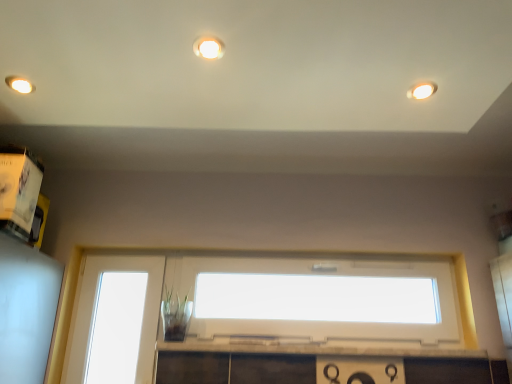
Image resolution: width=512 pixels, height=384 pixels. In order to click on white plastic window at center, which is the 1th window from right to left in this screenshot , I will do `click(317, 299)`.

This screenshot has height=384, width=512. What do you see at coordinates (19, 84) in the screenshot?
I see `matte white light fixture at upper left, the 1th lighting in the left-to-right sequence` at bounding box center [19, 84].

Where is `white plastic window at center, which is the 1th window from right to left`? white plastic window at center, which is the 1th window from right to left is located at coordinates (317, 299).

Considering the sizes of objects matte white light fixture at upper center, which is counted as the 2th lighting, starting from the right, and transparent glass window at lower left, the 1th window in the left-to-right sequence, in the image provided, who is smaller, matte white light fixture at upper center, which is counted as the 2th lighting, starting from the right, or transparent glass window at lower left, the 1th window in the left-to-right sequence,?

Smaller between the two is matte white light fixture at upper center, which is counted as the 2th lighting, starting from the right.

Based on the photo, does matte white light fixture at upper center, marked as the first lighting in a front-to-back arrangement, lie in front of transparent glass window at lower left, which appears as the 2th window when viewed from the right?

That is True.

Choose the correct answer: Is matte white light fixture at upper center, the third lighting when ordered from back to front, inside transparent glass window at lower left, which appears as the 2th window when viewed from the right, or outside it?

matte white light fixture at upper center, the third lighting when ordered from back to front, exists outside the volume of transparent glass window at lower left, which appears as the 2th window when viewed from the right.

Is matte white light fixture at upper center, which is counted as the 2th lighting, starting from the right, to the left or to the right of transparent glass window at lower left, which appears as the 2th window when viewed from the right, in the image?

In the image, matte white light fixture at upper center, which is counted as the 2th lighting, starting from the right, appears on the right side of transparent glass window at lower left, which appears as the 2th window when viewed from the right.

Consider the image. From the image's perspective, is white plastic window at center, which is the 1th window from right to left, positioned above or below matte white light fixture at upper center, the 3th lighting in the bottom-to-top sequence?

white plastic window at center, which is the 1th window from right to left, is below matte white light fixture at upper center, the 3th lighting in the bottom-to-top sequence.

Identify the location of window that is the 1st one below the matte white light fixture at upper center, which is counted as the 2th lighting, starting from the right (from a real-world perspective). (317, 299).

Is white plastic window at center, the second window from the left, oriented towards matte white light fixture at upper center, the 2th lighting from the left?

No, white plastic window at center, the second window from the left, is not turned towards matte white light fixture at upper center, the 2th lighting from the left.

In the scene shown: Looking at their sizes, would you say white plastic window at center, the second window from the left, is wider or thinner than matte white light fixture at upper center, which is counted as the 2th lighting, starting from the right?

Clearly, white plastic window at center, the second window from the left, has more width compared to matte white light fixture at upper center, which is counted as the 2th lighting, starting from the right.

Considering the points (333, 312) and (422, 98), which point is behind, point (333, 312) or point (422, 98)?

The point (333, 312) is behind.

Is white plastic window at center, the second window from the left, looking in the opposite direction of matte white light fixture at upper right, positioned as the first lighting in bottom-to-top order?

No.

Measure the distance from white plastic window at center, which is the 1th window from right to left, to matte white light fixture at upper right, marked as the 2th lighting in a front-to-back arrangement.

A distance of 3.45 meters exists between white plastic window at center, which is the 1th window from right to left, and matte white light fixture at upper right, marked as the 2th lighting in a front-to-back arrangement.

Which object is closer to the camera, white plastic window at center, which is the 1th window from right to left, or matte white light fixture at upper right, positioned as the first lighting in bottom-to-top order?

matte white light fixture at upper right, positioned as the first lighting in bottom-to-top order, is more forward.

From a real-world perspective, between transparent glass window at lower left, the 1th window in the left-to-right sequence, and matte white light fixture at upper left, which is the 3th lighting from right to left, who is vertically higher?

matte white light fixture at upper left, which is the 3th lighting from right to left.

Considering the points (104, 314) and (28, 83), which point is behind, point (104, 314) or point (28, 83)?

The point (104, 314) is behind.

Is transparent glass window at lower left, the 1th window in the left-to-right sequence, wider than matte white light fixture at upper left, which is the 3th lighting from right to left?

In fact, transparent glass window at lower left, the 1th window in the left-to-right sequence, might be narrower than matte white light fixture at upper left, which is the 3th lighting from right to left.

Is transparent glass window at lower left, the 1th window in the left-to-right sequence, touching matte white light fixture at upper right, the 3th lighting viewed from the left?

No, transparent glass window at lower left, the 1th window in the left-to-right sequence, is not next to matte white light fixture at upper right, the 3th lighting viewed from the left.

Which of these two, transparent glass window at lower left, the 1th window in the left-to-right sequence, or matte white light fixture at upper right, the 3th lighting viewed from the left, stands shorter?

Standing shorter between the two is matte white light fixture at upper right, the 3th lighting viewed from the left.

Which object is closer to the camera taking this photo, transparent glass window at lower left, which appears as the 2th window when viewed from the right, or matte white light fixture at upper right, the 3th lighting viewed from the left?

matte white light fixture at upper right, the 3th lighting viewed from the left.

Does matte white light fixture at upper left, which is the 3th lighting from right to left, appear on the left side of matte white light fixture at upper right, the 3th lighting viewed from the left?

Yes.

From a real-world perspective, is matte white light fixture at upper left, which is the 3th lighting from right to left, physically below matte white light fixture at upper right, the 3th lighting viewed from the left?

Incorrect, from a real-world perspective, matte white light fixture at upper left, which is the 3th lighting from right to left, is higher than matte white light fixture at upper right, the 3th lighting viewed from the left.

Does matte white light fixture at upper left, the 1th lighting in the left-to-right sequence, come in front of matte white light fixture at upper right, marked as the 2th lighting in a front-to-back arrangement?

No, matte white light fixture at upper left, the 1th lighting in the left-to-right sequence, is further to the viewer.

You are a GUI agent. You are given a task and a screenshot of the screen. Output one action in this format:
    pyautogui.click(x=<x>, y=<y>)
    Task: Click on the 2nd lighting counting from the left of the matte white light fixture at upper right, marked as the third lighting in a top-to-bottom arrangement
    This screenshot has width=512, height=384.
    Given the screenshot: What is the action you would take?
    19,84

Is matte white light fixture at upper left, which is the 3th lighting from right to left, further to the viewer compared to matte white light fixture at upper center, which is counted as the 2th lighting, starting from the right?

Yes, matte white light fixture at upper left, which is the 3th lighting from right to left, is further from the camera.

From the image's perspective, is matte white light fixture at upper left, marked as the first lighting in a back-to-front arrangement, above or below matte white light fixture at upper center, which ranks as the 1th lighting in top-to-bottom order?

matte white light fixture at upper left, marked as the first lighting in a back-to-front arrangement, is below matte white light fixture at upper center, which ranks as the 1th lighting in top-to-bottom order.

Is matte white light fixture at upper center, which is counted as the 2th lighting, starting from the right, a part of matte white light fixture at upper left, which is the 3th lighting from right to left?

Actually, matte white light fixture at upper center, which is counted as the 2th lighting, starting from the right, is outside matte white light fixture at upper left, which is the 3th lighting from right to left.

From the picture: Is matte white light fixture at upper left, which is the 3th lighting from right to left, oriented towards matte white light fixture at upper center, the 2th lighting from the left?

No, matte white light fixture at upper left, which is the 3th lighting from right to left, is not oriented towards matte white light fixture at upper center, the 2th lighting from the left.

You are a GUI agent. You are given a task and a screenshot of the screen. Output one action in this format:
    pyautogui.click(x=<x>, y=<y>)
    Task: Click on the 2nd window behind when counting from the matte white light fixture at upper center, the 3th lighting in the bottom-to-top sequence
    This screenshot has height=384, width=512.
    Given the screenshot: What is the action you would take?
    pyautogui.click(x=116, y=328)

The width and height of the screenshot is (512, 384). What are the coordinates of `lighting that is the 2nd object above the white plastic window at center, the second window from the left (from a real-world perspective)` in the screenshot? It's located at [209, 49].

Estimate the real-world distances between objects in this image. Which object is closer to matte white light fixture at upper left, which is the 3th lighting from right to left, transparent glass window at lower left, the 1th window in the left-to-right sequence, or matte white light fixture at upper right, marked as the third lighting in a top-to-bottom arrangement?

Among the two, matte white light fixture at upper right, marked as the third lighting in a top-to-bottom arrangement, is located nearer to matte white light fixture at upper left, which is the 3th lighting from right to left.

When comparing their distances from transparent glass window at lower left, the 1th window in the left-to-right sequence, does matte white light fixture at upper center, the third lighting when ordered from back to front, or matte white light fixture at upper right, positioned as the first lighting in bottom-to-top order, seem closer?

Among the two, matte white light fixture at upper center, the third lighting when ordered from back to front, is located nearer to transparent glass window at lower left, the 1th window in the left-to-right sequence.

When comparing their distances from matte white light fixture at upper right, positioned as the 1th lighting in right-to-left order, does matte white light fixture at upper left, which is the 3th lighting from right to left, or matte white light fixture at upper center, the 2th lighting from the left, seem further?

matte white light fixture at upper left, which is the 3th lighting from right to left, is positioned further to the anchor matte white light fixture at upper right, positioned as the 1th lighting in right-to-left order.

When comparing their distances from transparent glass window at lower left, which appears as the 2th window when viewed from the right, does matte white light fixture at upper right, positioned as the 1th lighting in right-to-left order, or matte white light fixture at upper left, the 1th lighting in the left-to-right sequence, seem closer?

matte white light fixture at upper left, the 1th lighting in the left-to-right sequence, is closer to transparent glass window at lower left, which appears as the 2th window when viewed from the right.

Considering their positions, is matte white light fixture at upper left, acting as the 3th lighting starting from the front, positioned closer to matte white light fixture at upper right, marked as the third lighting in a top-to-bottom arrangement, than transparent glass window at lower left, which appears as the 2th window when viewed from the right?

Among the two, matte white light fixture at upper left, acting as the 3th lighting starting from the front, is located nearer to matte white light fixture at upper right, marked as the third lighting in a top-to-bottom arrangement.

Which object lies nearer to the anchor point matte white light fixture at upper center, which ranks as the 1th lighting in top-to-bottom order, matte white light fixture at upper right, placed as the second lighting when sorted from back to front, or white plastic window at center, the second window from the left?

Among the two, matte white light fixture at upper right, placed as the second lighting when sorted from back to front, is located nearer to matte white light fixture at upper center, which ranks as the 1th lighting in top-to-bottom order.

Looking at the image, which one is located further to matte white light fixture at upper left, acting as the 3th lighting starting from the front, transparent glass window at lower left, which appears as the 2th window when viewed from the right, or matte white light fixture at upper center, marked as the first lighting in a front-to-back arrangement?

The object further to matte white light fixture at upper left, acting as the 3th lighting starting from the front, is transparent glass window at lower left, which appears as the 2th window when viewed from the right.

Considering their positions, is white plastic window at center, which is the 1th window from right to left, positioned further to matte white light fixture at upper left, the 1th lighting in the left-to-right sequence, than transparent glass window at lower left, the 1th window in the left-to-right sequence?

white plastic window at center, which is the 1th window from right to left, is positioned further to the anchor matte white light fixture at upper left, the 1th lighting in the left-to-right sequence.

You are a GUI agent. You are given a task and a screenshot of the screen. Output one action in this format:
    pyautogui.click(x=<x>, y=<y>)
    Task: Click on the lighting between matte white light fixture at upper left, the 1th lighting in the left-to-right sequence, and matte white light fixture at upper right, marked as the third lighting in a top-to-bottom arrangement
    
    Given the screenshot: What is the action you would take?
    pyautogui.click(x=209, y=49)

Where is `window between transparent glass window at lower left, the 1th window in the left-to-right sequence, and matte white light fixture at upper right, positioned as the 1th lighting in right-to-left order`? The width and height of the screenshot is (512, 384). window between transparent glass window at lower left, the 1th window in the left-to-right sequence, and matte white light fixture at upper right, positioned as the 1th lighting in right-to-left order is located at coordinates (317, 299).

The image size is (512, 384). What are the coordinates of `lighting between transparent glass window at lower left, which appears as the 2th window when viewed from the right, and matte white light fixture at upper right, marked as the third lighting in a top-to-bottom arrangement` in the screenshot? It's located at (209, 49).

Find the location of `window between matte white light fixture at upper center, the 3th lighting in the bottom-to-top sequence, and transparent glass window at lower left, the 1th window in the left-to-right sequence, in the up-down direction`. window between matte white light fixture at upper center, the 3th lighting in the bottom-to-top sequence, and transparent glass window at lower left, the 1th window in the left-to-right sequence, in the up-down direction is located at coordinates (317, 299).